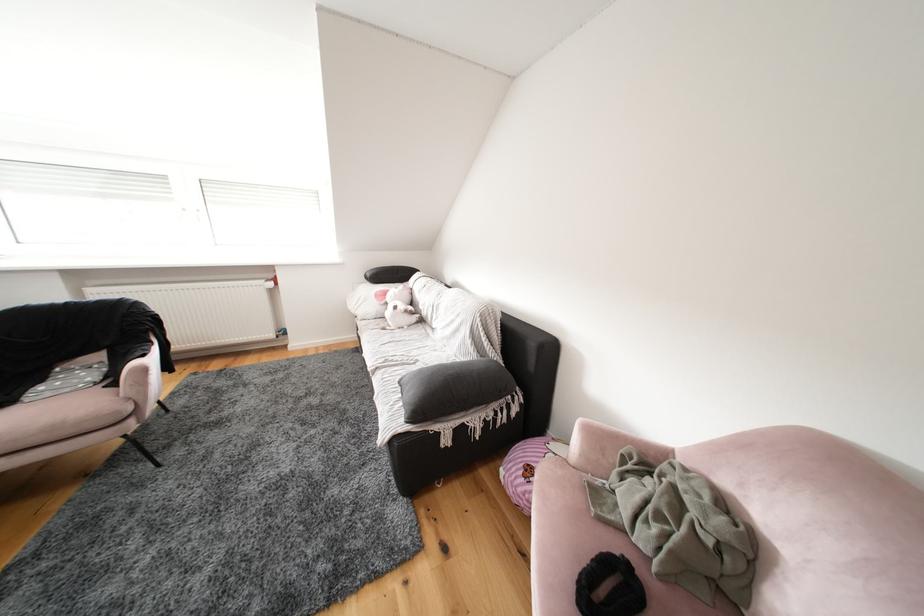
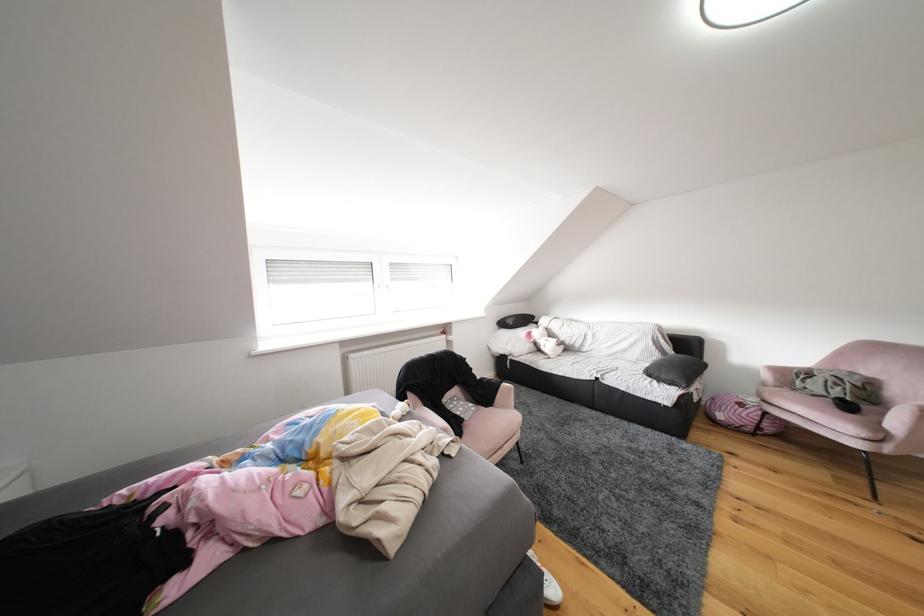
Question: What movement of the cameraman would produce the second image?

Choices:
 (A) Left
 (B) Right
 (C) Forward
 (D) Backward

Answer: (A)